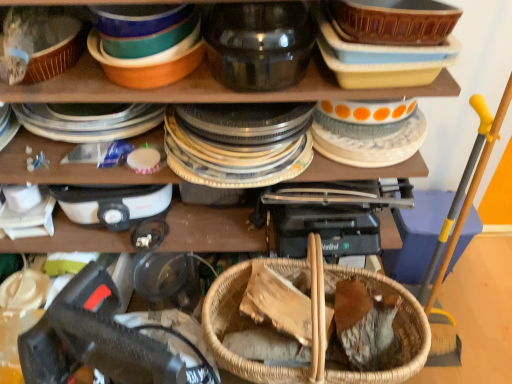
Question: Looking at their shapes, would you say white plastic appliance at upper left is wider or thinner than woven wood basket at center?

Choices:
 (A) thin
 (B) wide

Answer: (A)

Question: Is white plastic appliance at upper left taller or shorter than woven wood basket at center?

Choices:
 (A) tall
 (B) short

Answer: (B)

Question: Which is farther from the white glossy plate at upper right, placed as the first tableware when sorted from right to left?

Choices:
 (A) transparent glass jar at upper center, the first tableware from the left
 (B) white plastic appliance at upper left
 (C) woven wood basket at center

Answer: (B)

Question: Based on their relative distances, which object is nearer to the white glossy plate at upper right, the 2th tableware positioned from the left?

Choices:
 (A) woven wood basket at center
 (B) white plastic appliance at upper left
 (C) transparent glass jar at upper center, the second tableware in the right-to-left sequence

Answer: (C)